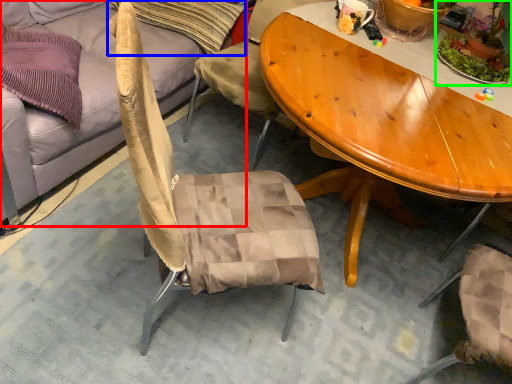
Question: Based on their relative distances, which object is farther from studio couch (highlighted by a red box)? Choose from pillow (highlighted by a blue box) and houseplant (highlighted by a green box).

Choices:
 (A) pillow
 (B) houseplant

Answer: (B)